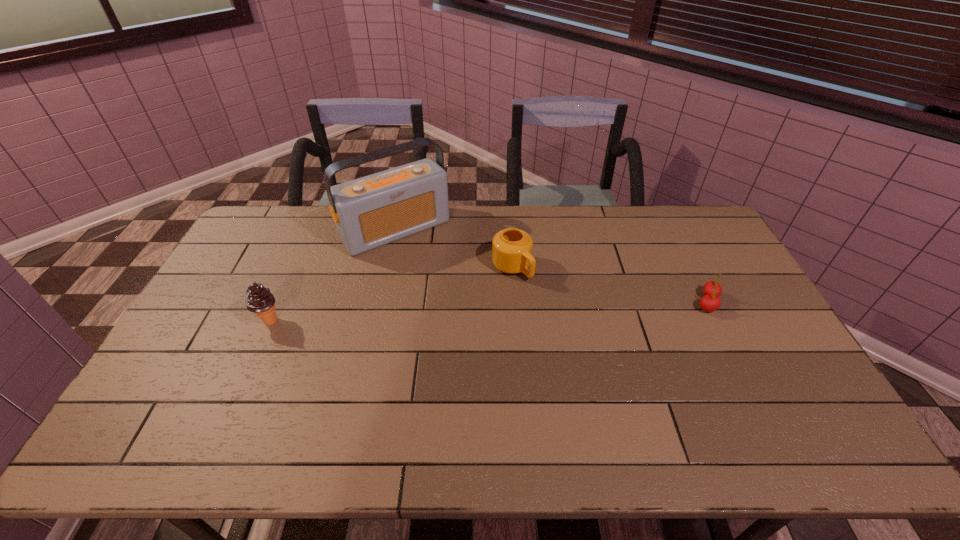
In order to click on vacant space that is in between the tallest object and the mug in this screenshot , I will do `click(454, 249)`.

I want to click on empty space between the tallest object and the third tallest object, so click(x=454, y=249).

In order to click on vacant area between the shortest object and the second tallest object in this screenshot , I will do `click(489, 312)`.

Locate an element on the screen. This screenshot has width=960, height=540. free space between the second tallest object and the third tallest object is located at coordinates (391, 294).

Identify the location of object that is the third closest one to the shortest object. Image resolution: width=960 pixels, height=540 pixels. (260, 300).

Identify the location of object that is the nearest to the second shortest object. (369, 212).